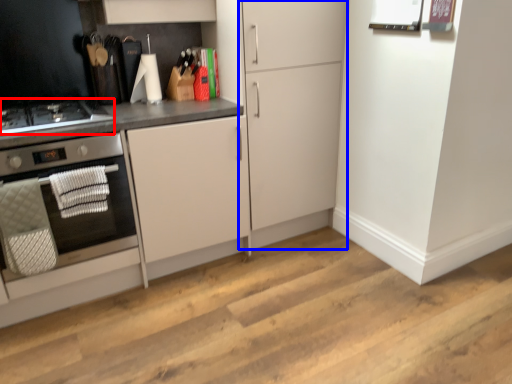
Question: Which point is closer to the camera, gas stove (highlighted by a red box) or cabinetry (highlighted by a blue box)?

Choices:
 (A) gas stove
 (B) cabinetry

Answer: (A)